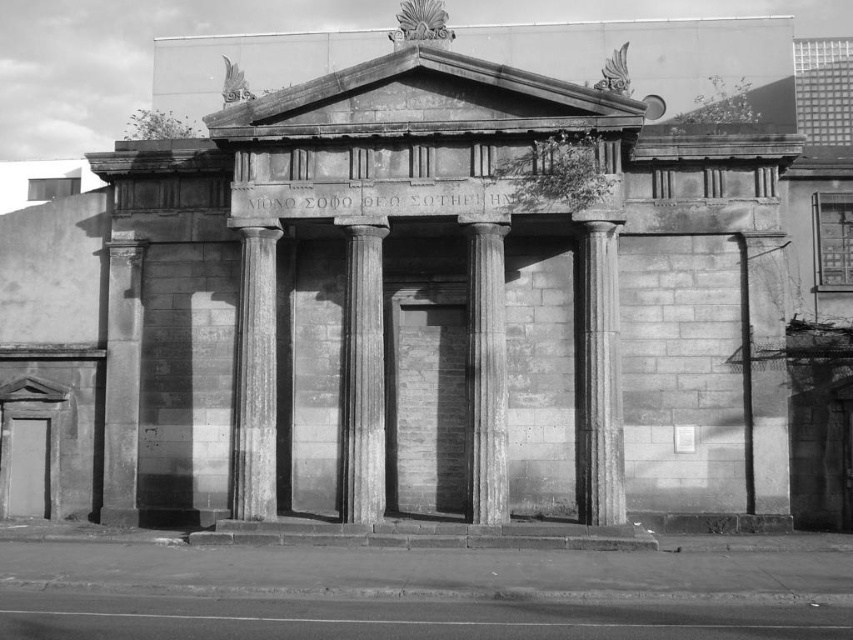
From the picture: You are an architect examining the classical structure. You need to place a decorative sculpture exactly at the center of the gray stone column at center. Where should you position the sculpture based on the coordinates provided?

The gray stone column at center is located at point (x=363, y=376), so you should position the decorative sculpture exactly at those coordinates to place it at the center of the column.